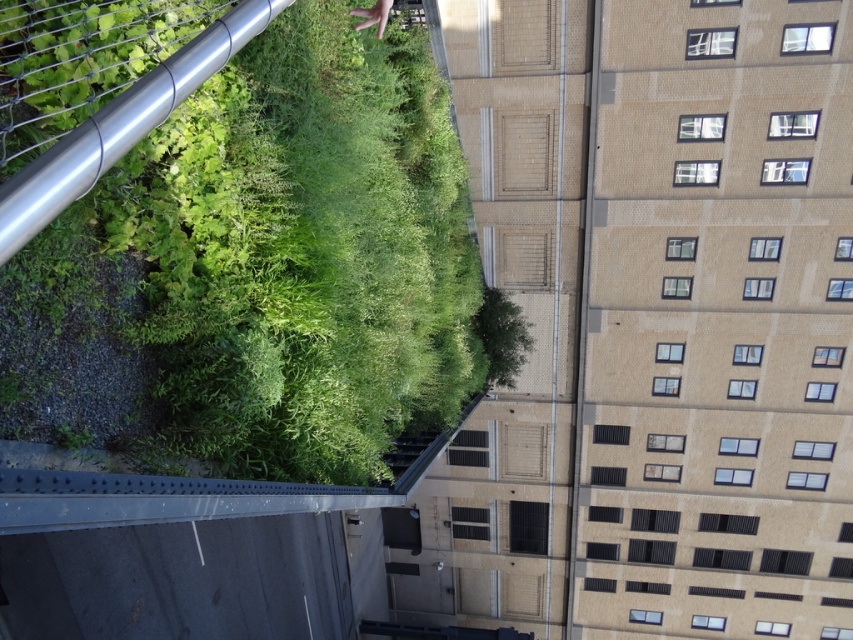
Question: Does green leafy plant at upper left appear under skin tone flesh hand at upper center?

Choices:
 (A) yes
 (B) no

Answer: (A)

Question: Is green leafy plant at upper left smaller than skin tone flesh hand at upper center?

Choices:
 (A) yes
 (B) no

Answer: (B)

Question: Is green leafy plant at upper left further to the viewer compared to skin tone flesh hand at upper center?

Choices:
 (A) yes
 (B) no

Answer: (B)